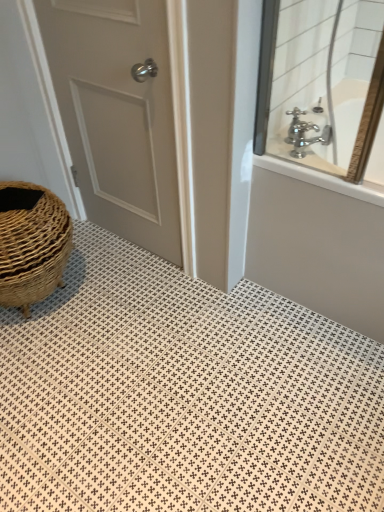
Question: Can you confirm if polished chrome faucet at upper right is positioned to the left of white matte door at left?

Choices:
 (A) no
 (B) yes

Answer: (A)

Question: Can you confirm if polished chrome faucet at upper right is positioned to the right of white matte door at left?

Choices:
 (A) yes
 (B) no

Answer: (A)

Question: From a real-world perspective, is polished chrome faucet at upper right physically below white matte door at left?

Choices:
 (A) yes
 (B) no

Answer: (B)

Question: Would you say white matte door at left is part of polished chrome faucet at upper right's contents?

Choices:
 (A) yes
 (B) no

Answer: (B)

Question: Are polished chrome faucet at upper right and white matte door at left located far from each other?

Choices:
 (A) yes
 (B) no

Answer: (B)

Question: Is polished chrome faucet at upper right smaller than white matte door at left?

Choices:
 (A) no
 (B) yes

Answer: (B)

Question: Considering the relative sizes of chrome metallic faucet at upper right and polished chrome faucet at upper right in the image provided, is chrome metallic faucet at upper right wider than polished chrome faucet at upper right?

Choices:
 (A) yes
 (B) no

Answer: (B)

Question: From the image's perspective, is chrome metallic faucet at upper right over polished chrome faucet at upper right?

Choices:
 (A) yes
 (B) no

Answer: (B)

Question: Does chrome metallic faucet at upper right have a larger size compared to polished chrome faucet at upper right?

Choices:
 (A) no
 (B) yes

Answer: (A)

Question: Can you confirm if chrome metallic faucet at upper right is shorter than polished chrome faucet at upper right?

Choices:
 (A) no
 (B) yes

Answer: (B)

Question: From the image's perspective, does chrome metallic faucet at upper right appear lower than polished chrome faucet at upper right?

Choices:
 (A) yes
 (B) no

Answer: (A)

Question: Is chrome metallic faucet at upper right at the right side of polished chrome faucet at upper right?

Choices:
 (A) yes
 (B) no

Answer: (B)

Question: From a real-world perspective, is polished chrome faucet at upper right physically above white textured tile at lower left?

Choices:
 (A) yes
 (B) no

Answer: (A)